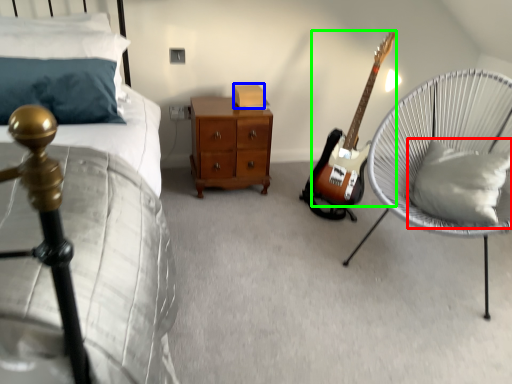
Question: Estimate the real-world distances between objects in this image. Which object is closer to pillow (highlighted by a red box), box (highlighted by a blue box) or guitar (highlighted by a green box)?

Choices:
 (A) box
 (B) guitar

Answer: (B)